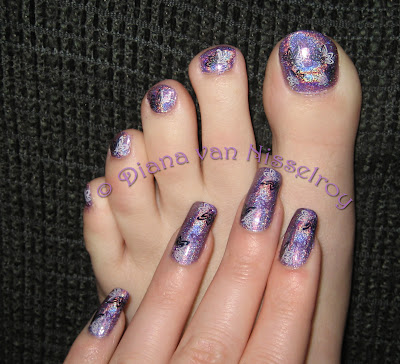
Where is `black butterfly stickers`? Image resolution: width=400 pixels, height=364 pixels. black butterfly stickers is located at coordinates (118, 302), (180, 245), (208, 213), (244, 209), (309, 227).